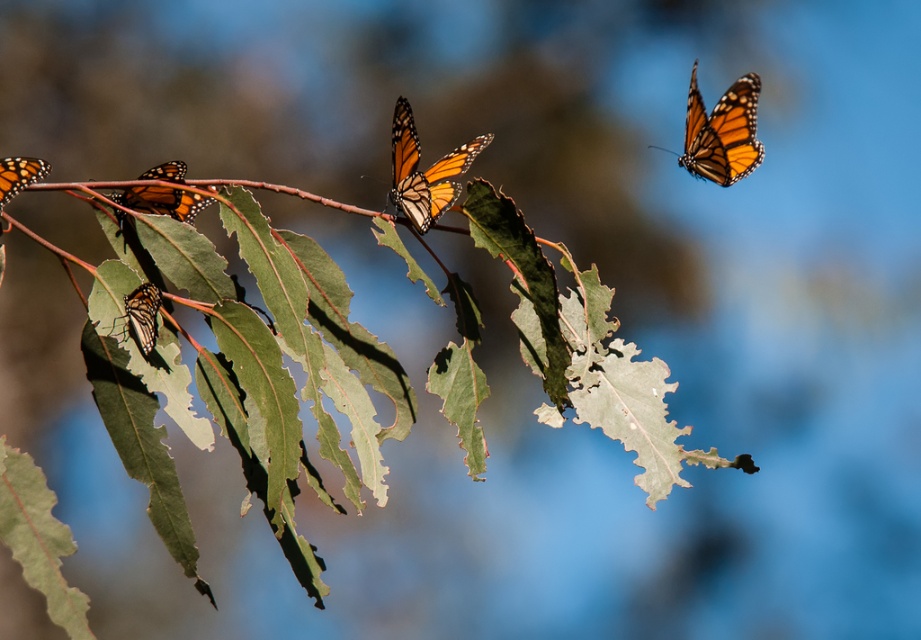
Does green leafy branch at center have a lesser height compared to orange-patterned butterfly at left?

No, green leafy branch at center is not shorter than orange-patterned butterfly at left.

Between green leafy branch at center and orange-patterned butterfly at left, which one is positioned lower?

green leafy branch at center

Does point (474, 188) lie in front of point (144, 202)?

Yes, point (474, 188) is in front of point (144, 202).

At what (x,y) coordinates should I click in order to perform the action: click on green leafy branch at center. Please return your answer as a coordinate pair (x, y). The width and height of the screenshot is (921, 640). Looking at the image, I should click on (236, 358).

Does green leafy branch at center have a lesser width compared to orange and black wings at left?

Incorrect, green leafy branch at center's width is not less than orange and black wings at left's.

In the scene shown: Can you confirm if green leafy branch at center is wider than orange and black wings at left?

Indeed, green leafy branch at center has a greater width compared to orange and black wings at left.

Where is `green leafy branch at center`? green leafy branch at center is located at coordinates (236, 358).

Is orange-patterned butterfly at lower left below orange and black wings at left?

Indeed, orange-patterned butterfly at lower left is positioned under orange and black wings at left.

This screenshot has width=921, height=640. What do you see at coordinates (142, 314) in the screenshot?
I see `orange-patterned butterfly at lower left` at bounding box center [142, 314].

Identify the location of orange-patterned butterfly at lower left. (142, 314).